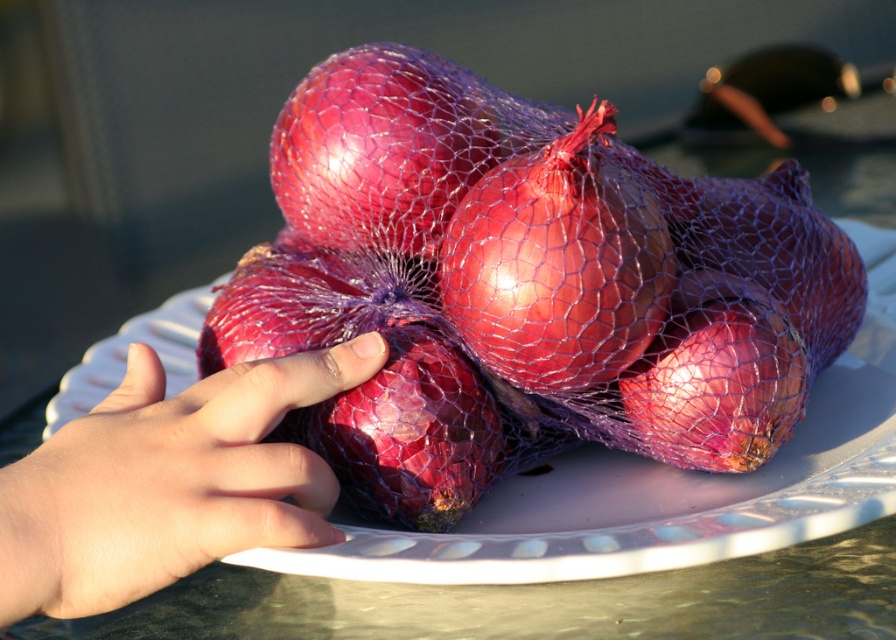
Does smooth skin hand at center appear over glossy plastic onion at center?

Incorrect, smooth skin hand at center is not positioned above glossy plastic onion at center.

Between point (30, 481) and point (377, 97), which one is positioned in front?

Point (30, 481) is more forward.

Where is `smooth skin hand at center`? This screenshot has height=640, width=896. smooth skin hand at center is located at coordinates (168, 481).

Can you confirm if smooth skin hand at center is wider than glossy mesh onion at center?

Indeed, smooth skin hand at center has a greater width compared to glossy mesh onion at center.

Is point (54, 612) positioned behind point (562, 353)?

That is False.

What do you see at coordinates (168, 481) in the screenshot? The image size is (896, 640). I see `smooth skin hand at center` at bounding box center [168, 481].

I want to click on smooth skin hand at center, so click(x=168, y=481).

Describe the element at coordinates (380, 148) in the screenshot. This screenshot has width=896, height=640. I see `glossy plastic onion at center` at that location.

Is point (291, 164) less distant than point (698, 385)?

No, (291, 164) is behind (698, 385).

Locate an element on the screen. The height and width of the screenshot is (640, 896). glossy plastic onion at center is located at coordinates (380, 148).